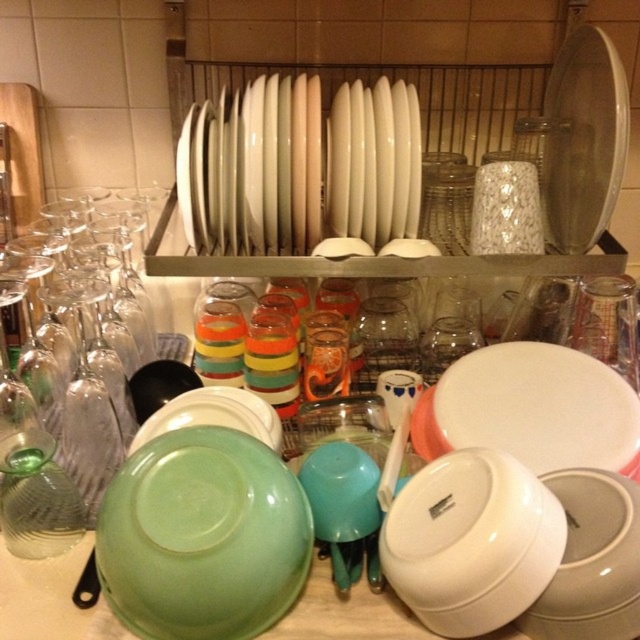
You are a kitchen assistant who needs to place a new bowl in the dish rack. The dish rack has limited space. You have a new bowl that is 6 inches in diameter. Can you fit it between the green matte bowl at lower left and the green plastic bowl at center?

The distance between the green matte bowl at lower left and the green plastic bowl at center is 5.56 inches. Since the new bowl is 6 inches in diameter, it cannot fit in that space as the distance is smaller than the bowl.

You are trying to place a new dish in the kitchen. You have a round plate that is 25 cm in diameter. Based on the items in the dish rack, can you determine if the white glossy platter at center or the green plastic bowl at center has enough space to accommodate this plate?

The white glossy platter at center might be wider than the green plastic bowl at center, so it could potentially accommodate the 25 cm diameter plate if its width is sufficient. However, without exact measurements, it is uncertain. The green plastic bowl at center may be narrower and less likely to fit the plate.

You are standing in the kitchen looking at the dish rack. There are two points marked on the dish rack at coordinates point (566, 225) and point (224, 401). Which point is closer to you?

Point (224, 401) is closer to you because it is in front of point (566, 225) according to their positions.